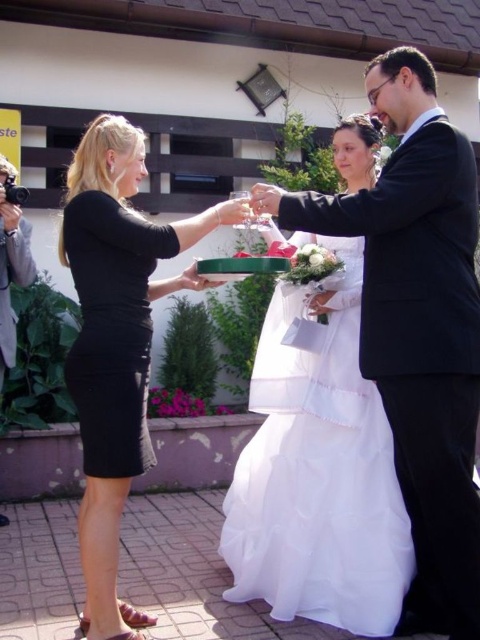
Question: Is white satin dress at center above black matte dress at center?

Choices:
 (A) no
 (B) yes

Answer: (A)

Question: Which object is closer to the camera taking this photo?

Choices:
 (A) black matte dress at left
 (B) black satin suit at center
 (C) black matte dress at center

Answer: (B)

Question: Which of the following is the closest to the observer?

Choices:
 (A) white satin dress at center
 (B) black satin suit at center

Answer: (B)

Question: Which is nearer to the white satin dress at center?

Choices:
 (A) black satin suit at center
 (B) black matte dress at center

Answer: (A)

Question: Can you confirm if white satin dress at center is smaller than matte black camera at left?

Choices:
 (A) no
 (B) yes

Answer: (A)

Question: Does black matte dress at center appear on the right side of black matte dress at left?

Choices:
 (A) yes
 (B) no

Answer: (A)